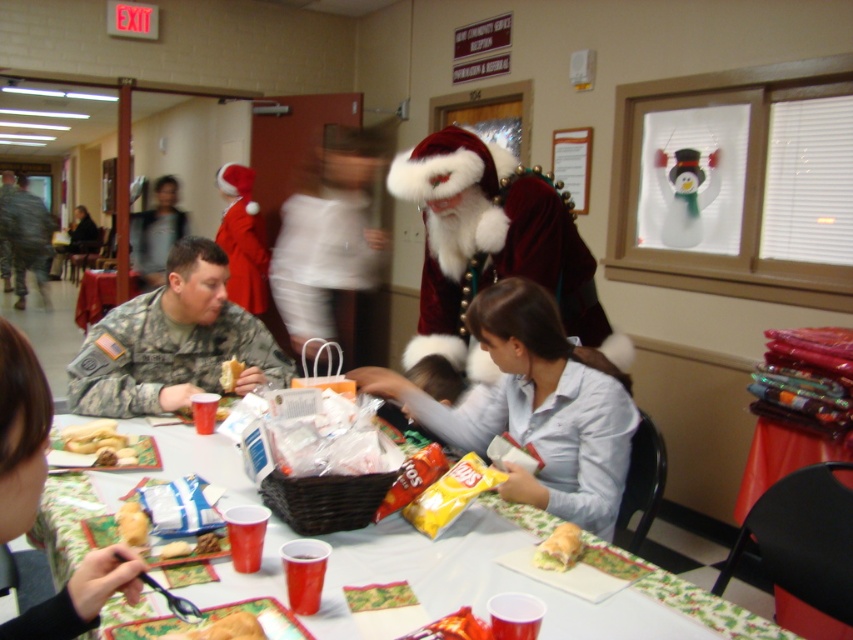
Who is taller, yellow crinkled paper at center or matte plastic bag at center?

With more height is yellow crinkled paper at center.

Who is shorter, yellow crinkled paper at center or matte plastic bag at center?

Standing shorter between the two is matte plastic bag at center.

Which is behind, point (556, 556) or point (172, 550)?

Point (556, 556)

Identify the location of yellow crinkled paper at center. (560, 547).

Looking at this image, is light blue cotton shirt at center taller than camouflage uniform at center?

Yes.

Is light blue cotton shirt at center smaller than camouflage uniform at center?

No.

Is point (599, 390) behind point (142, 369)?

No, (599, 390) is in front of (142, 369).

The image size is (853, 640). What are the coordinates of `light blue cotton shirt at center` in the screenshot? It's located at click(x=534, y=406).

Is matte plastic table at center to the left of bread matte at center from the viewer's perspective?

In fact, matte plastic table at center is to the right of bread matte at center.

Who is more distant from viewer, (531,516) or (223,380)?

Point (223,380)

The image size is (853, 640). Identify the location of matte plastic table at center. [514, 580].